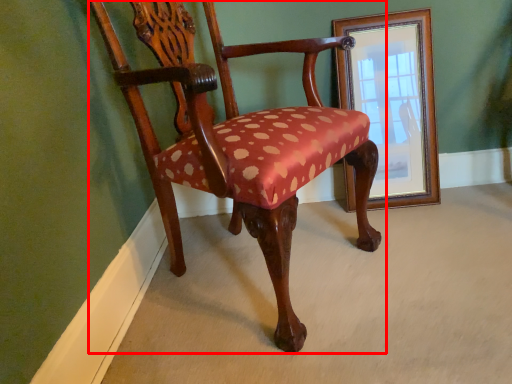
Question: From the image's perspective, where is chair (annotated by the red box) located in relation to picture frame in the image?

Choices:
 (A) above
 (B) below

Answer: (B)